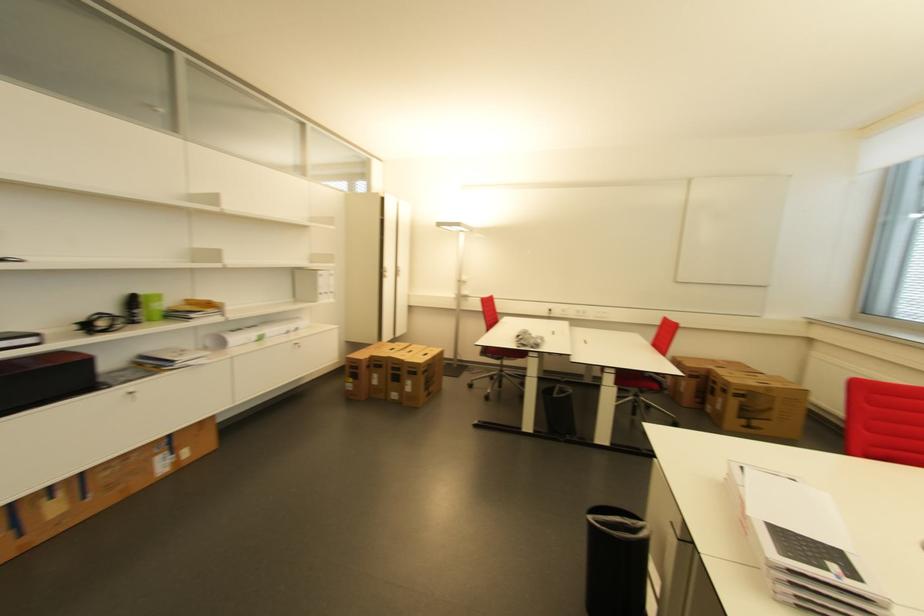
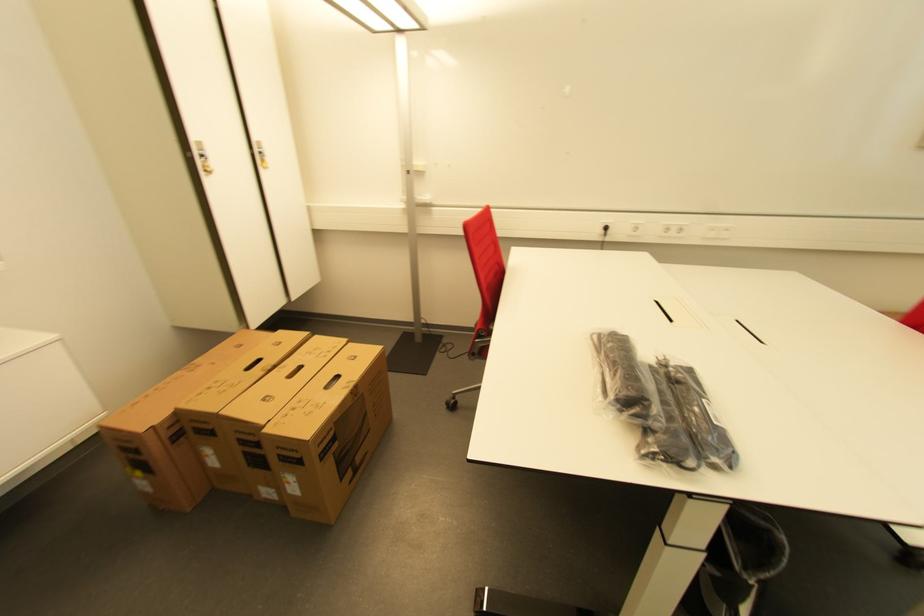
The point at (554, 312) is marked in the first image. Where is the corresponding point in the second image?

(611, 230)